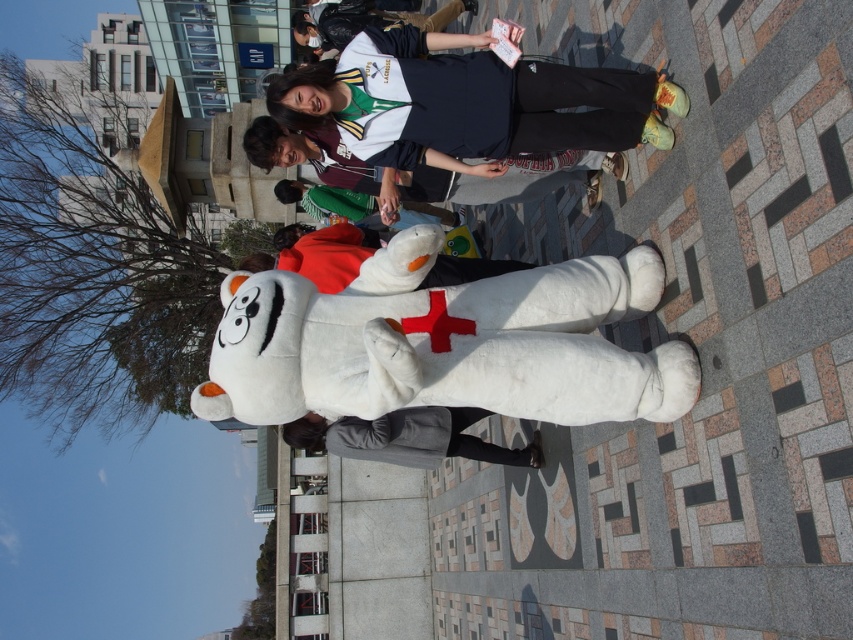
You are standing in the outdoor scene and want to locate the white plush bear at center. According to the coordinates provided, where should you look?

The white plush bear at center is located at coordinates point (445, 342).

You are a photographer trying to capture both the matte white jacket at center and the gray fleece jacket at lower center in a single shot. Based on their sizes in the image, which jacket would appear larger in the photo?

The matte white jacket at center appears larger in the photo because it is taller than the gray fleece jacket at lower center.